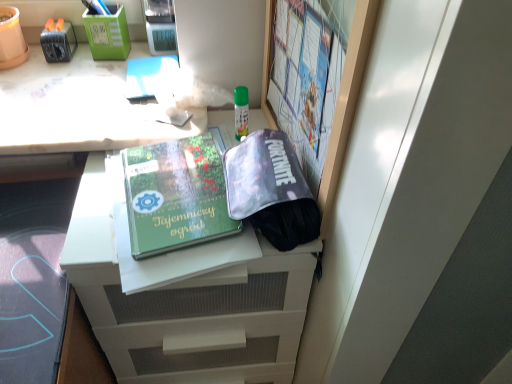
Image resolution: width=512 pixels, height=384 pixels. What are the coordinates of `free space to the left of green plastic pen holder at upper left, which is counted as the second stationery, starting from the left` in the screenshot? It's located at (50, 64).